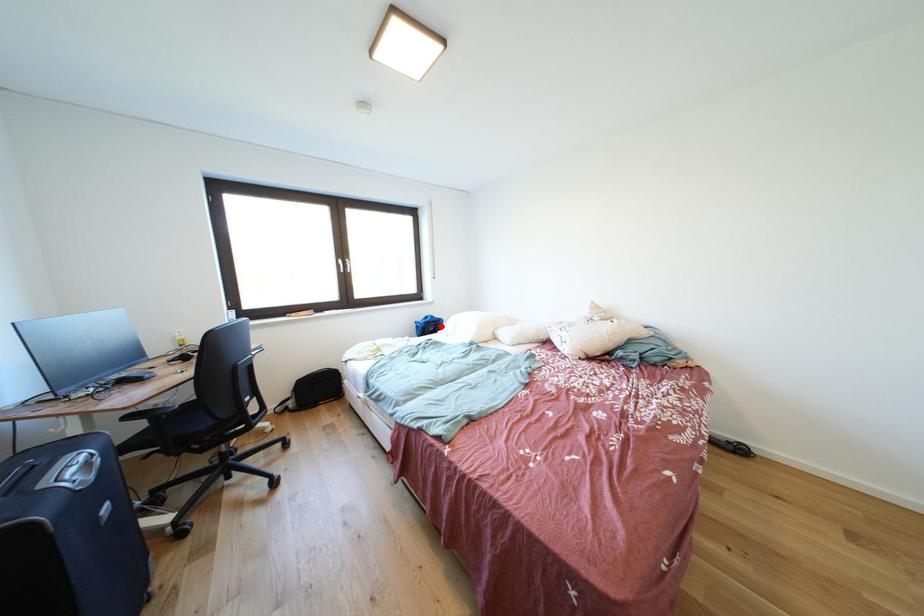
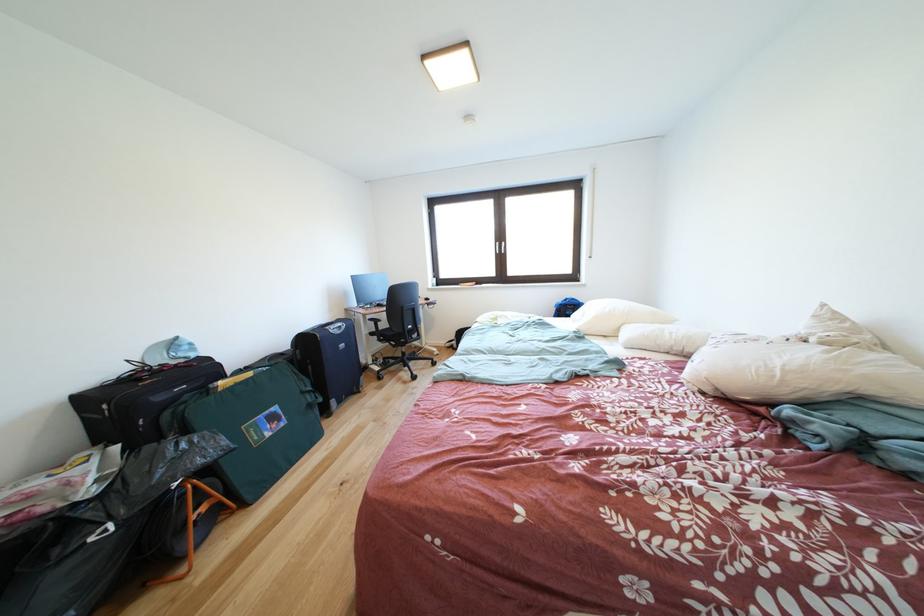
In the second image, find the point that corresponds to the highlighted location in the first image.

(578, 310)